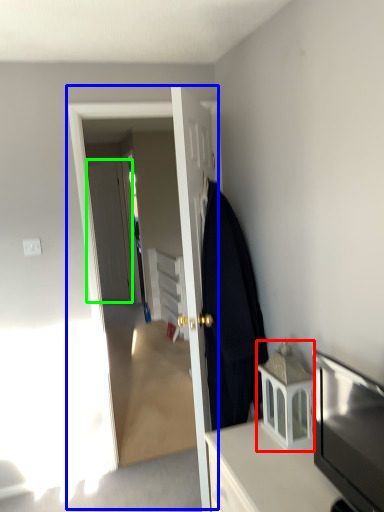
Question: Which object is the farthest from cabinetry (highlighted by a red box)? Choose among these: screen door (highlighted by a blue box) or door (highlighted by a green box).

Choices:
 (A) screen door
 (B) door

Answer: (B)